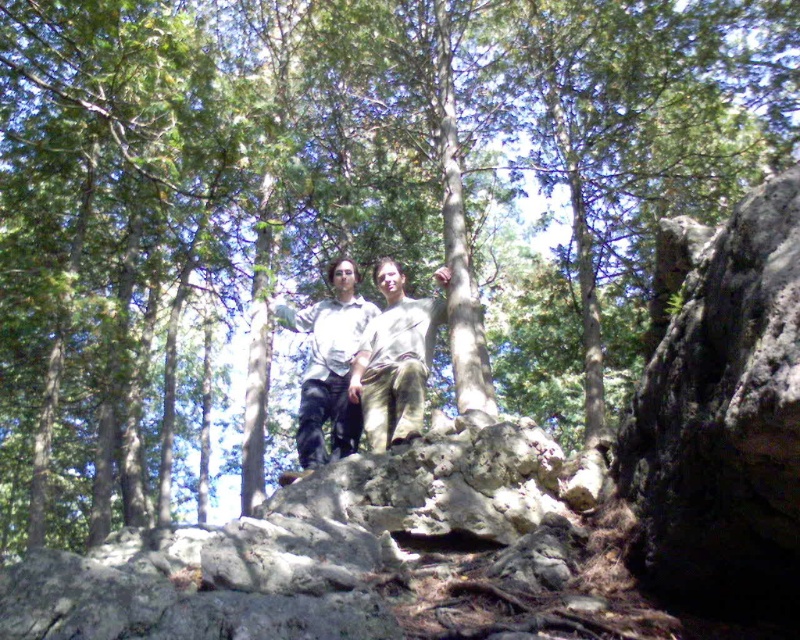
Can you confirm if light brown cotton pants at center is thinner than light brown cotton shirt at center?

Yes.

Based on the photo, does light brown cotton pants at center have a greater width compared to light brown cotton shirt at center?

Incorrect, light brown cotton pants at center's width does not surpass light brown cotton shirt at center's.

Is point (394, 440) behind point (350, 376)?

That is False.

The width and height of the screenshot is (800, 640). What are the coordinates of `light brown cotton pants at center` in the screenshot? It's located at (394, 362).